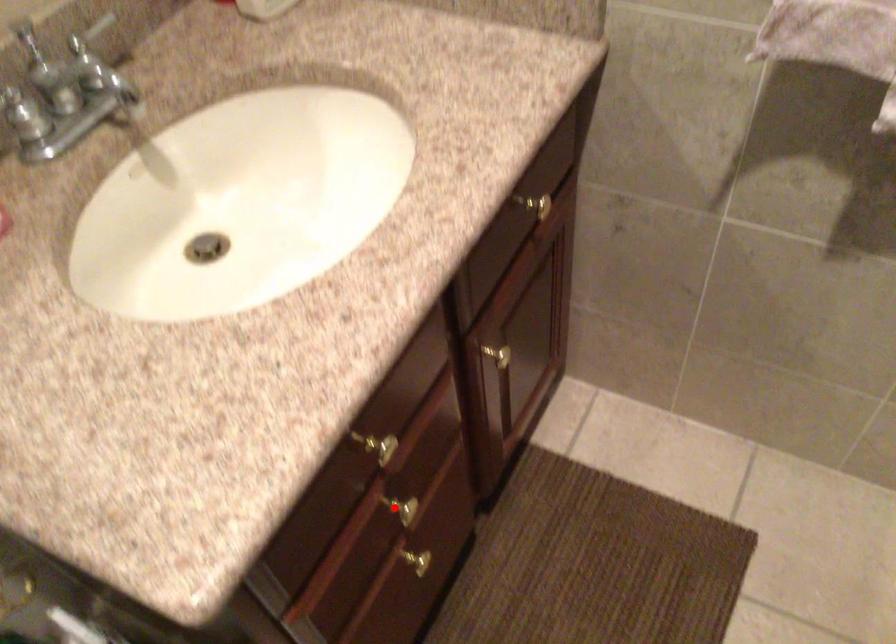
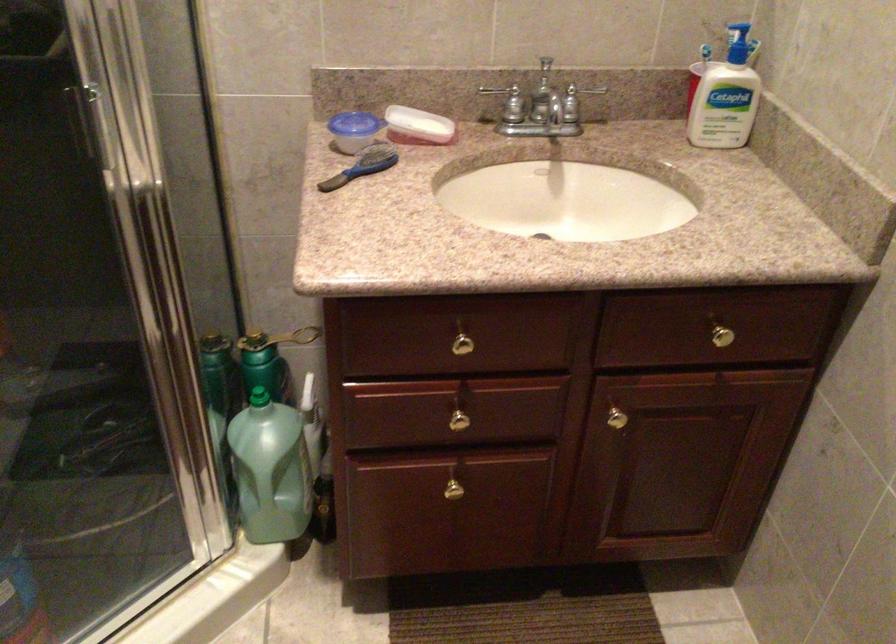
Question: I am providing you with two images of the same scene from different viewpoints. In image1, a red point is highlighted. Considering the same 3D point in image2, which of the following is correct?

Choices:
 (A) It is closer
 (B) It is farther

Answer: (B)